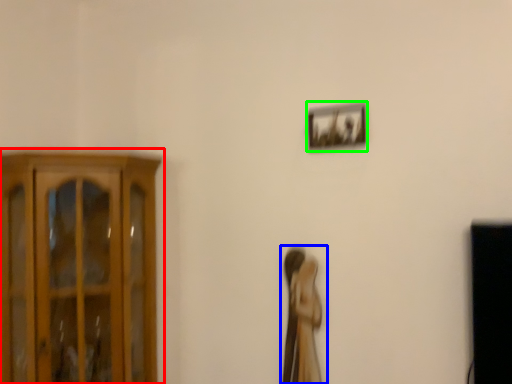
Question: Estimate the real-world distances between objects in this image. Which object is closer to cupboard (highlighted by a red box), woman (highlighted by a blue box) or picture frame (highlighted by a green box)?

Choices:
 (A) woman
 (B) picture frame

Answer: (A)